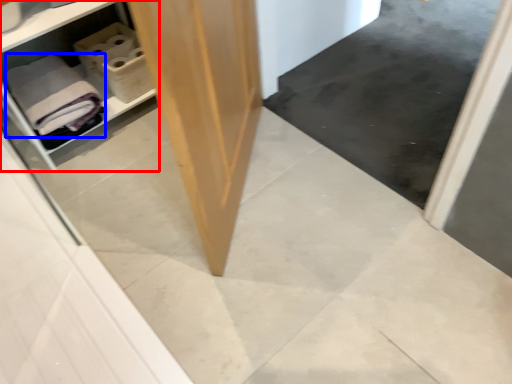
Question: Which object appears closest to the camera in this image, shelf (highlighted by a red box) or bath towel (highlighted by a blue box)?

Choices:
 (A) shelf
 (B) bath towel

Answer: (A)